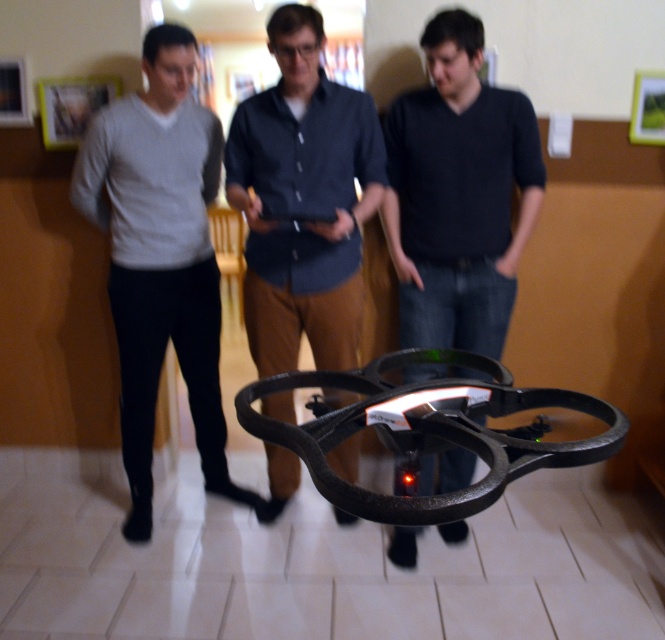
You are standing in a room where a drone is hovering. You see the matte gray sweater at left and the dark blue shirt at center. Which person is closer to the left side of the room?

The matte gray sweater at left is to the left of the dark blue shirt at center, so the person wearing the matte gray sweater at left is closer to the left side of the room.

You are standing in a room with two people wearing dark gray sweater at center and dark blue shirt at center. Which person is positioned to the right of the other?

The dark gray sweater at center is positioned to the right of the dark blue shirt at center.

You are a photographer standing 10 inches away from the matte gray sweater at left. You want to take a photo of the dark blue shirt at center without moving the camera. Can you do this without moving the camera?

The matte gray sweater at left is 13.76 inches from the dark blue shirt at center. Since you are 10 inches away from the matte gray sweater at left, the dark blue shirt at center is 13.76 inches away from you. Therefore, you can take the photo without moving the camera as the distance is sufficient.